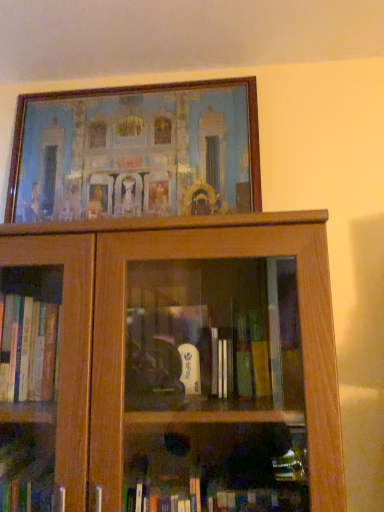
Locate an element on the screen. The image size is (384, 512). free spot above wooden picture frame at upper center (from a real-world perspective) is located at coordinates (127, 84).